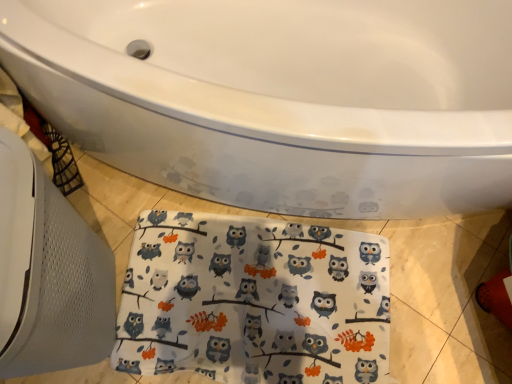
Question: Considering the positions of white glossy bathtub at center and white fabric with owl print at lower center in the image, is white glossy bathtub at center bigger or smaller than white fabric with owl print at lower center?

Choices:
 (A) small
 (B) big

Answer: (B)

Question: Is white glossy bathtub at center in front of or behind white fabric with owl print at lower center in the image?

Choices:
 (A) behind
 (B) front

Answer: (B)

Question: Considering the positions of white glossy bathtub at center and white fabric with owl print at lower center in the image, is white glossy bathtub at center wider or thinner than white fabric with owl print at lower center?

Choices:
 (A) thin
 (B) wide

Answer: (B)

Question: From a real-world perspective, is white fabric with owl print at lower center physically located above or below white glossy bathtub at center?

Choices:
 (A) above
 (B) below

Answer: (B)

Question: From their relative heights in the image, would you say white fabric with owl print at lower center is taller or shorter than white glossy bathtub at center?

Choices:
 (A) short
 (B) tall

Answer: (A)

Question: Is white fabric with owl print at lower center situated inside white glossy bathtub at center or outside?

Choices:
 (A) outside
 (B) inside

Answer: (A)

Question: In terms of width, does white fabric with owl print at lower center look wider or thinner when compared to white glossy bathtub at center?

Choices:
 (A) wide
 (B) thin

Answer: (B)